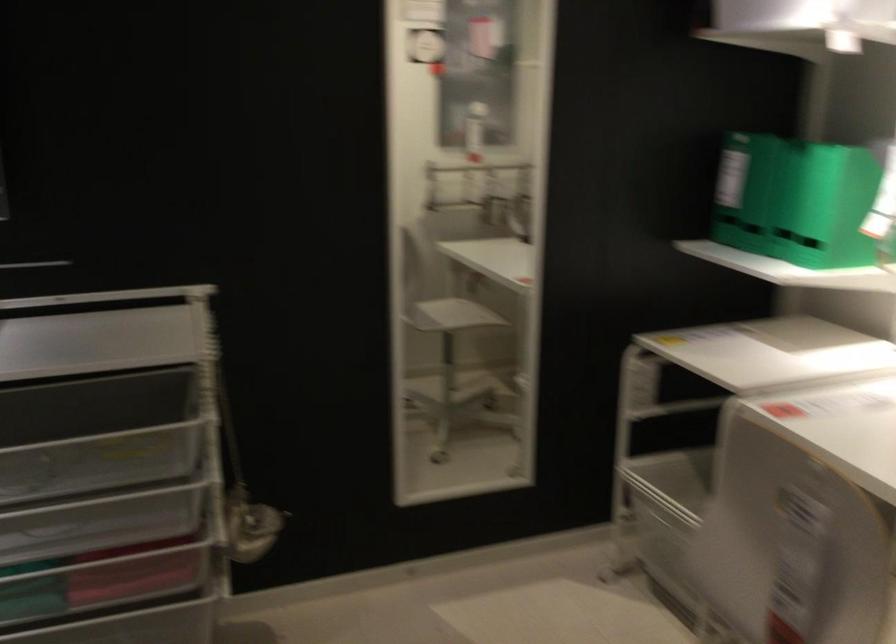
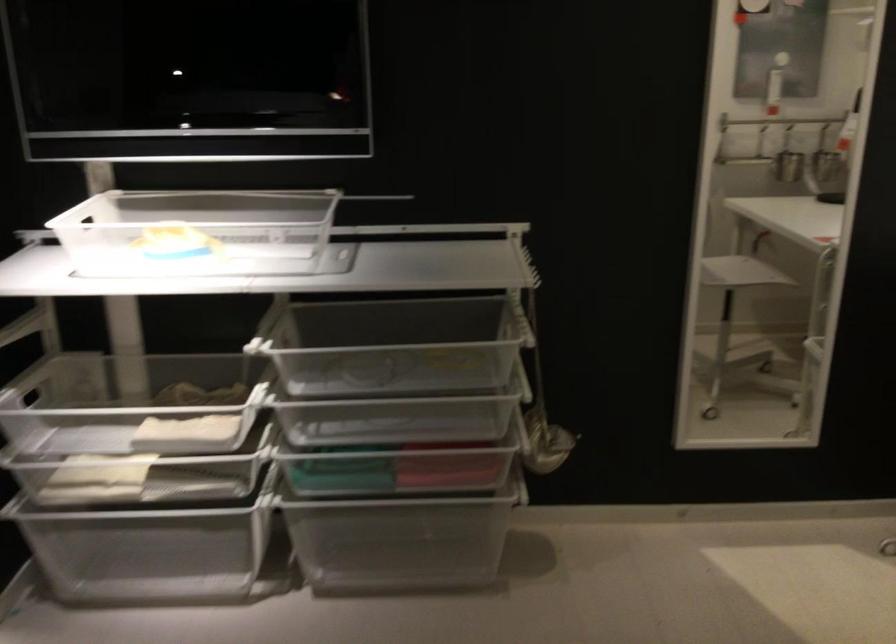
In the second image, find the point that corresponds to (x=242, y=497) in the first image.

(541, 415)